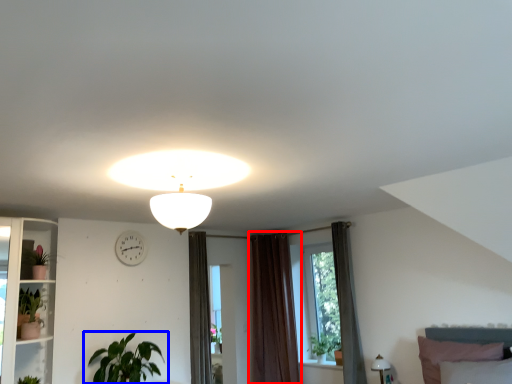
Question: Among these objects, which one is farthest to the camera, curtain (highlighted by a red box) or houseplant (highlighted by a blue box)?

Choices:
 (A) curtain
 (B) houseplant

Answer: (A)